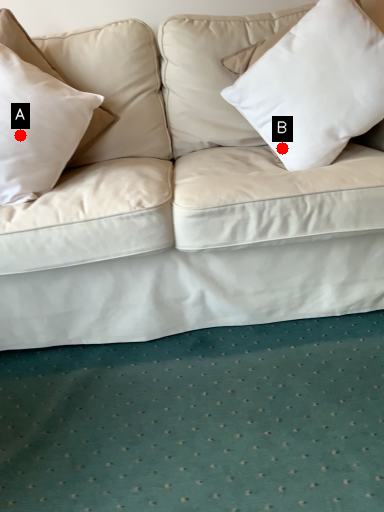
Question: Two points are circled on the image, labeled by A and B beside each circle. Which point is further to the camera?

Choices:
 (A) A is further
 (B) B is further

Answer: (B)